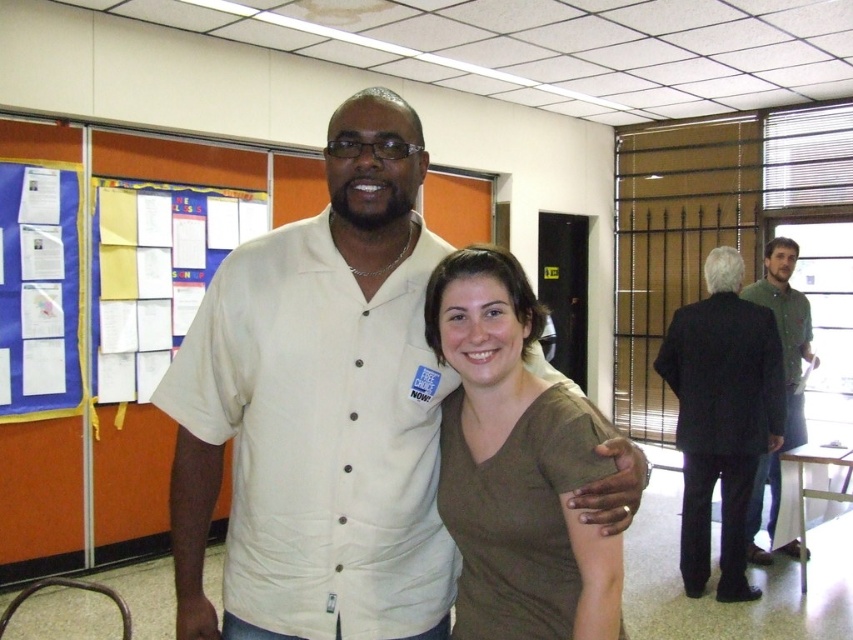
Question: Does white button-down shirt at center have a smaller size compared to green textured shirt at right?

Choices:
 (A) no
 (B) yes

Answer: (B)

Question: Which point is closer to the camera taking this photo?

Choices:
 (A) (778, 324)
 (B) (769, 374)

Answer: (B)

Question: From the image, what is the correct spatial relationship of white button-down shirt at center in relation to black suit at right?

Choices:
 (A) left
 (B) right

Answer: (A)

Question: Which point appears farthest from the camera in this image?

Choices:
 (A) (344, 102)
 (B) (779, 300)
 (C) (738, 518)
 (D) (576, 464)

Answer: (B)

Question: Which object appears farthest from the camera in this image?

Choices:
 (A) brown matte shirt at center
 (B) white button-down shirt at center

Answer: (B)

Question: Considering the relative positions of black suit at right and green textured shirt at right in the image provided, where is black suit at right located with respect to green textured shirt at right?

Choices:
 (A) below
 (B) above

Answer: (A)